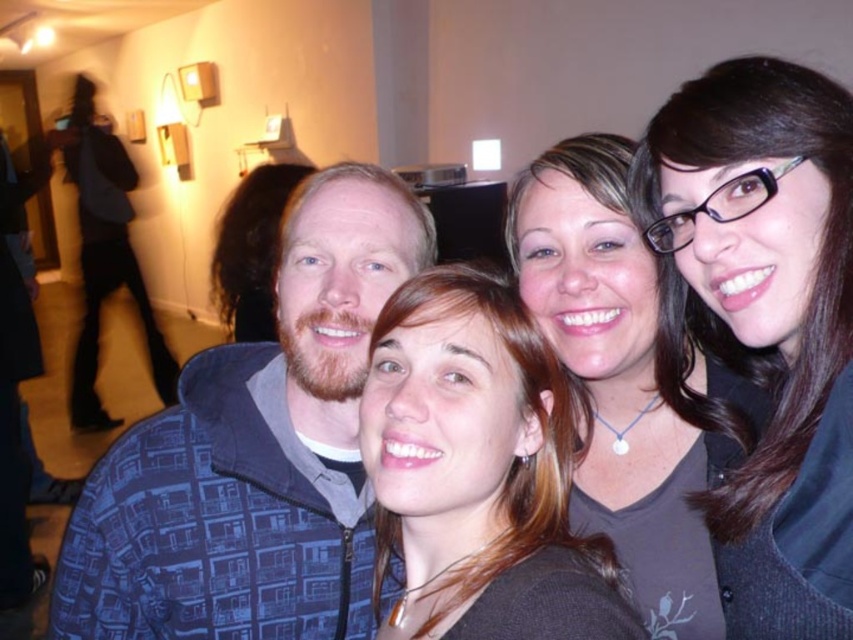
You are a photographer trying to adjust the focus of your camera. The blue printed jacket at center and smooth brown hair at center are both in the frame. Based on their distance apart, can you estimate how far apart they are in centimeters?

The blue printed jacket at center is 20.71 centimeters away from smooth brown hair at center.

You are a photographer trying to adjust the composition of a group photo. You notice the blue printed jacket at center and the blue patterned jacket at left. Which jacket is positioned lower in the image?

The blue printed jacket at center is located below the blue patterned jacket at left, so it is positioned lower in the image.

Based on the photo, you are taking a photo of the group and need to ensure that the smooth brown hair at center is visible. Based on its position, where should you focus your camera?

The smooth brown hair at center is located at point (477, 472), so you should focus your camera at that coordinate to ensure it is visible.